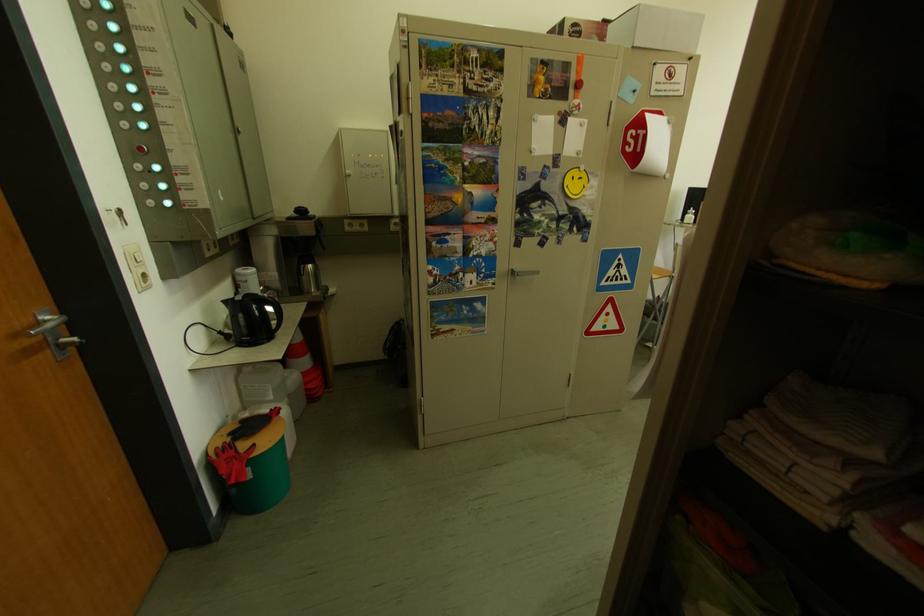
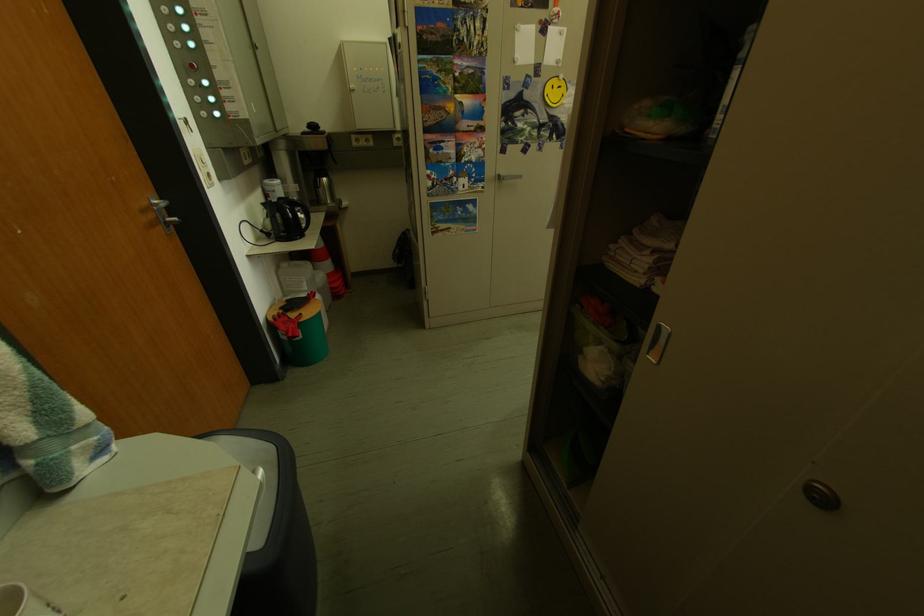
In the second image, find the point that corresponds to (565,172) in the first image.

(546, 82)